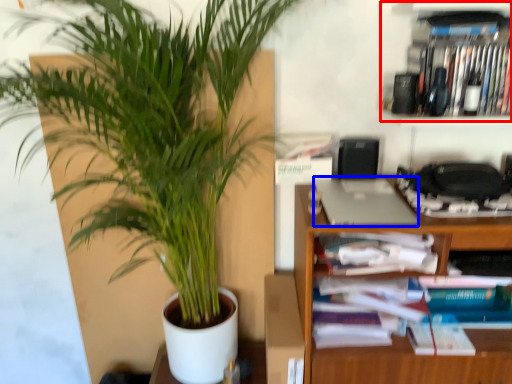
Question: Which object appears farthest to the camera in this image, cabinet (highlighted by a red box) or laptop (highlighted by a blue box)?

Choices:
 (A) cabinet
 (B) laptop

Answer: (A)